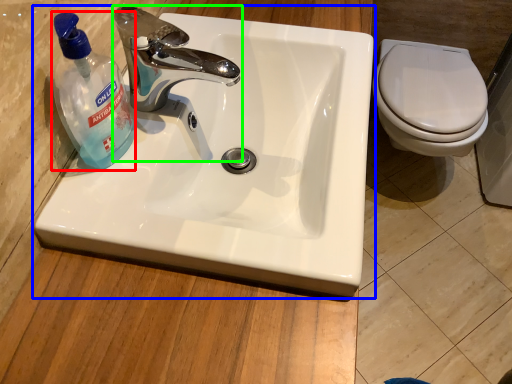
Question: Based on their relative distances, which object is nearer to cleaning product (highlighted by a red box)? Choose from sink (highlighted by a blue box) and tap (highlighted by a green box).

Choices:
 (A) sink
 (B) tap

Answer: (B)